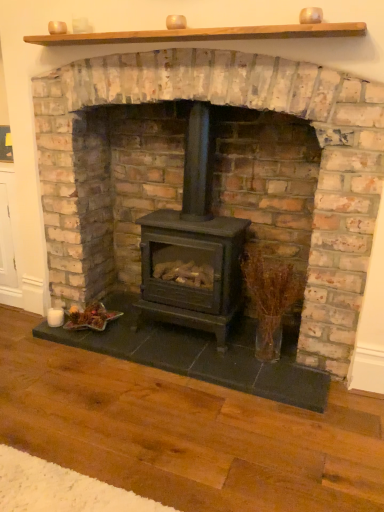
I want to click on free location in front of black matte wood burning stove at center, so click(x=200, y=364).